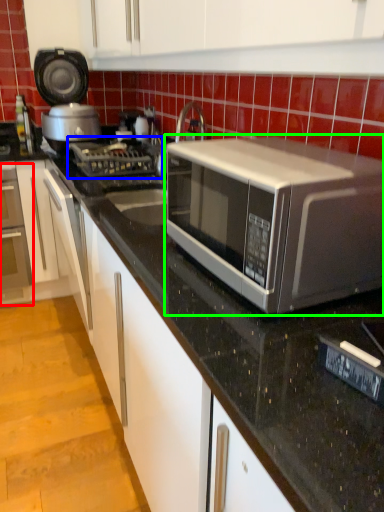
Question: Which is nearer to the oven (highlighted by a red box)? gas stove (highlighted by a blue box) or microwave oven (highlighted by a green box).

Choices:
 (A) gas stove
 (B) microwave oven

Answer: (A)